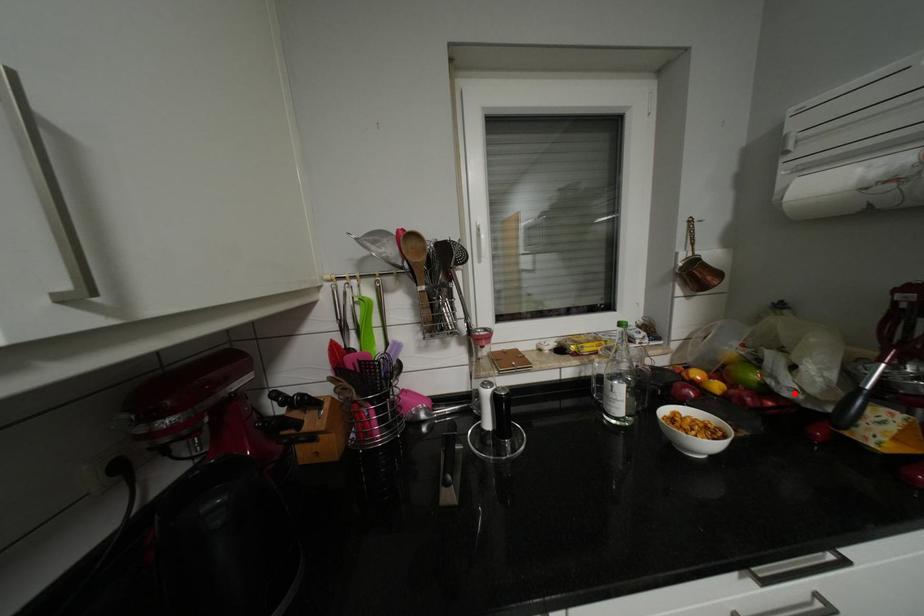
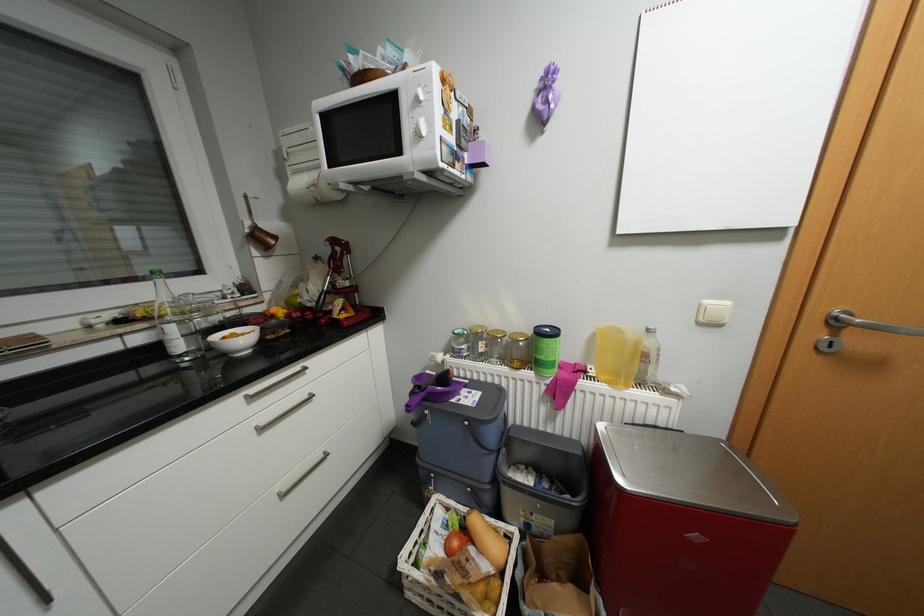
Locate, in the second image, the point that corresponds to the highlighted location in the first image.

(317, 304)